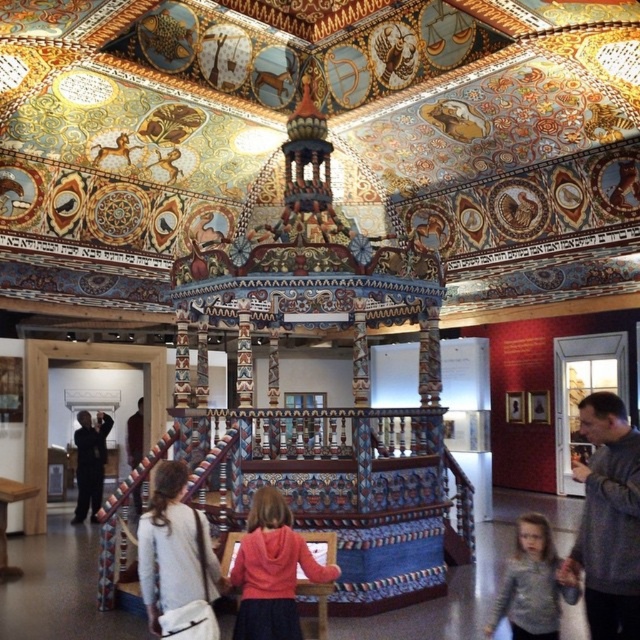
Question: Can you confirm if white fabric bag at lower left is positioned below matte pink hoodie at center?

Choices:
 (A) no
 (B) yes

Answer: (B)

Question: Is matte pink hoodie at center to the left of gray sweater at lower right from the viewer's perspective?

Choices:
 (A) yes
 (B) no

Answer: (A)

Question: Which point is farther to the camera?

Choices:
 (A) (192, 525)
 (B) (544, 528)
 (C) (272, 616)

Answer: (B)

Question: Which of the following is the closest to the observer?

Choices:
 (A) gray sweater at center
 (B) gray sweater at lower right
 (C) white fabric bag at lower left
 (D) matte pink hoodie at center

Answer: (A)

Question: Is white fabric bag at lower left further to camera compared to matte pink hoodie at center?

Choices:
 (A) no
 (B) yes

Answer: (B)

Question: Which object appears farthest from the camera in this image?

Choices:
 (A) gray sweater at center
 (B) gray sweater at lower right
 (C) matte pink hoodie at center
 (D) black matte suit at left

Answer: (D)